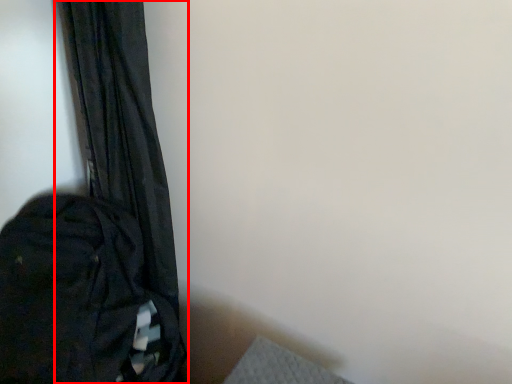
Question: In this image, where is curtain (annotated by the red box) located relative to backpack?

Choices:
 (A) left
 (B) right

Answer: (B)